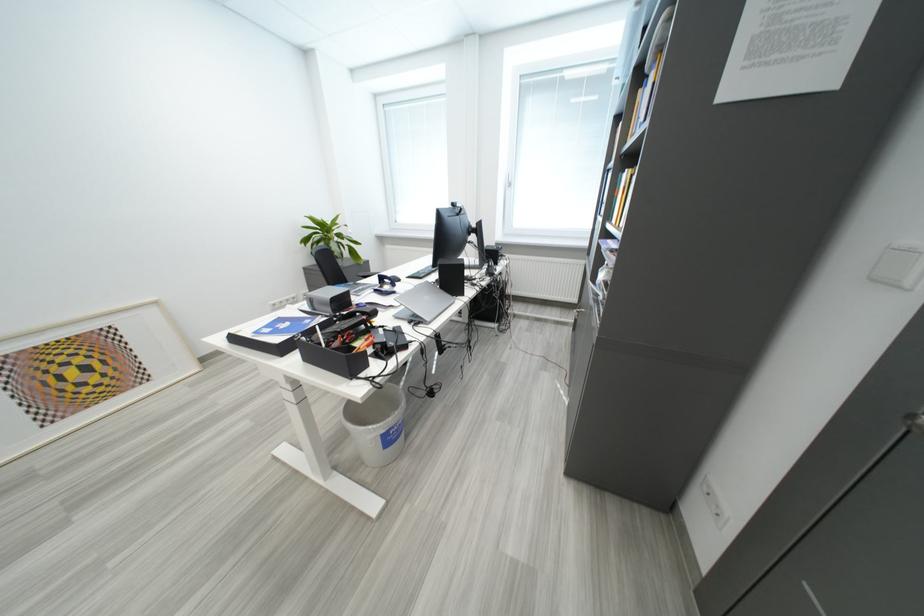
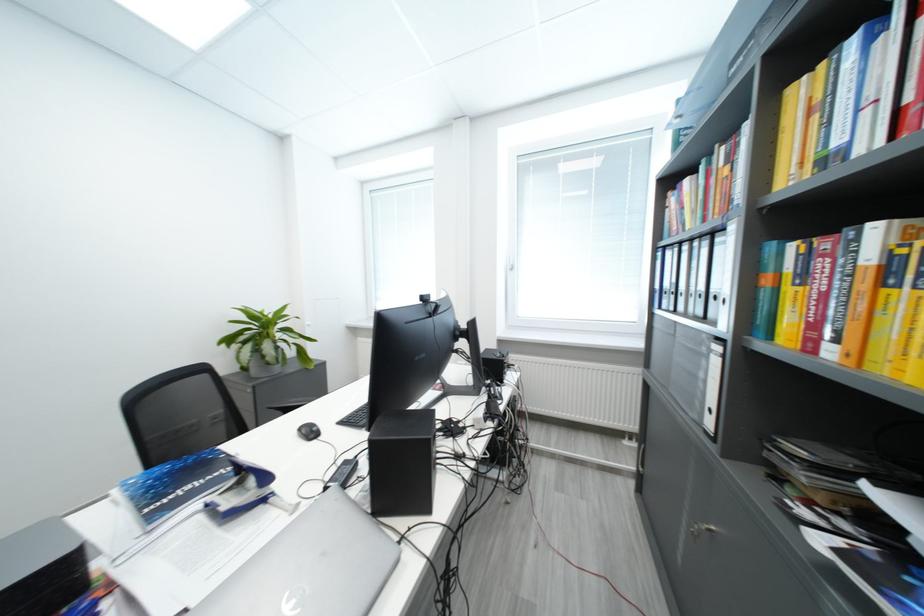
Locate, in the second image, the point that corresponds to (324,241) in the first image.

(251, 341)